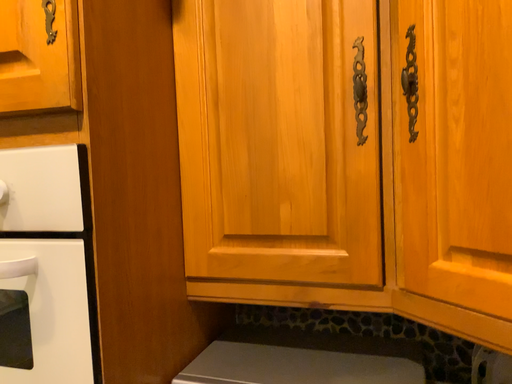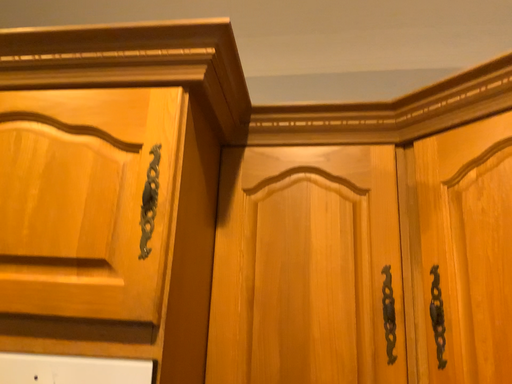
Question: How did the camera likely rotate when shooting the video?

Choices:
 (A) rotated right
 (B) rotated left

Answer: (A)